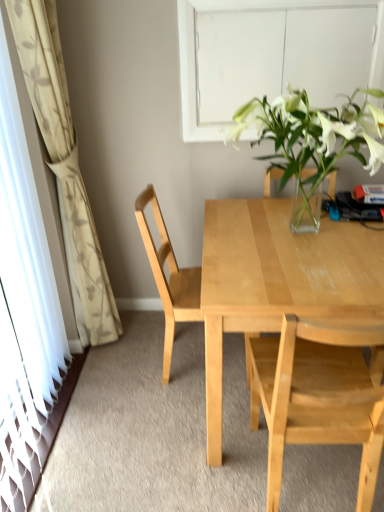
Question: Considering the positions of point (46, 73) and point (342, 68), is point (46, 73) closer or farther from the camera than point (342, 68)?

Choices:
 (A) farther
 (B) closer

Answer: (B)

Question: Is white floral-patterned curtain at left taller or shorter than white matte window at upper center?

Choices:
 (A) short
 (B) tall

Answer: (B)

Question: Which is nearer to the light wood desk at center?

Choices:
 (A) transparent glass door at left
 (B) white floral-patterned curtain at left
 (C) white matte window at upper center
 (D) light wood chair at center, the 2th chair positioned from the front
 (E) light wood chair at center, placed as the first chair when sorted from front to back

Answer: (E)

Question: Estimate the real-world distances between objects in this image. Which object is closer to the white matte window at upper center?

Choices:
 (A) light wood chair at center, placed as the first chair when sorted from front to back
 (B) light wood chair at center, marked as the first chair in a back-to-front arrangement
 (C) white floral-patterned curtain at left
 (D) light wood desk at center
 (E) transparent glass door at left

Answer: (D)